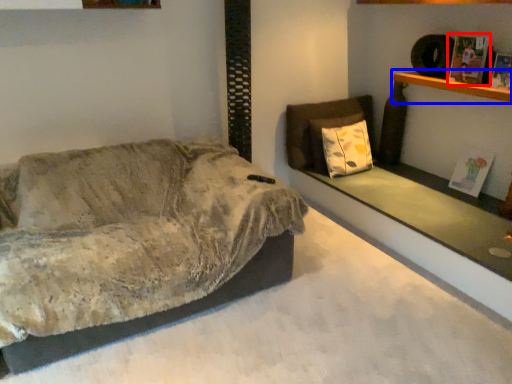
Question: Which object appears closest to the camera in this image, magazine (highlighted by a red box) or shelf (highlighted by a blue box)?

Choices:
 (A) magazine
 (B) shelf

Answer: (B)